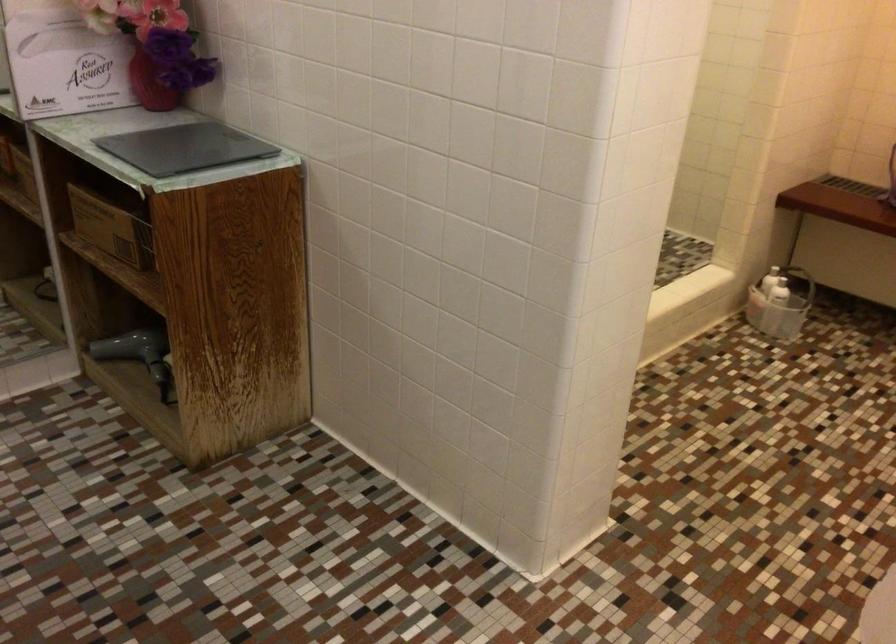
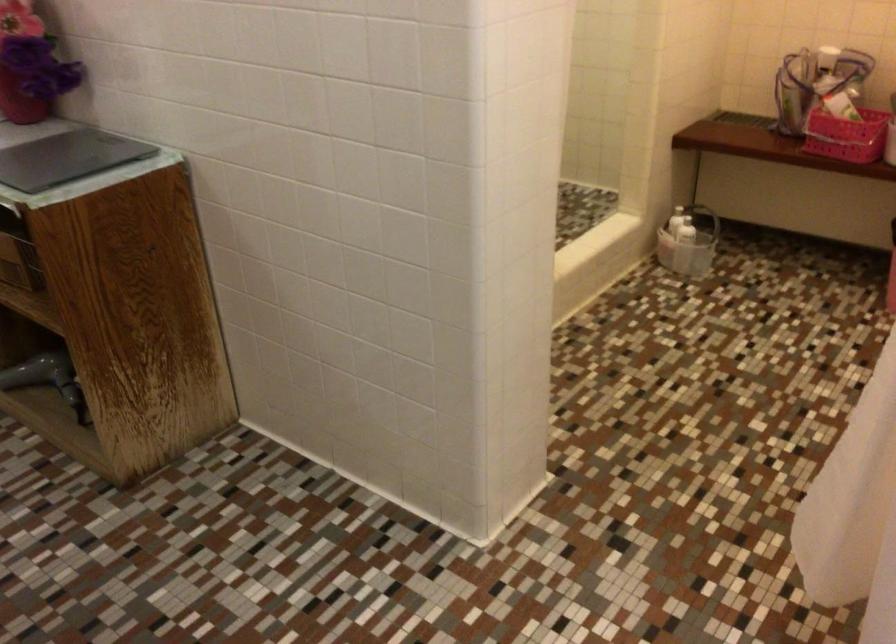
Where in the second image is the point corresponding to point 771,279 from the first image?

(678, 220)